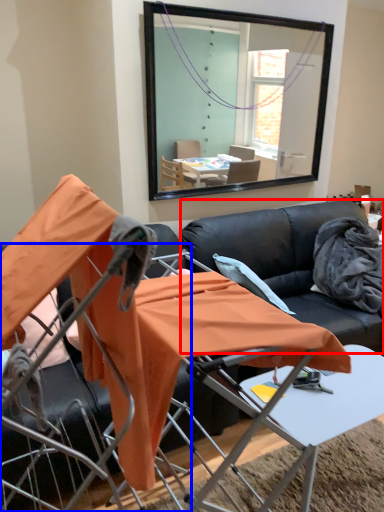
Question: Which point is closer to the camera, couch (highlighted by a red box) or chair (highlighted by a blue box)?

Choices:
 (A) couch
 (B) chair

Answer: (B)